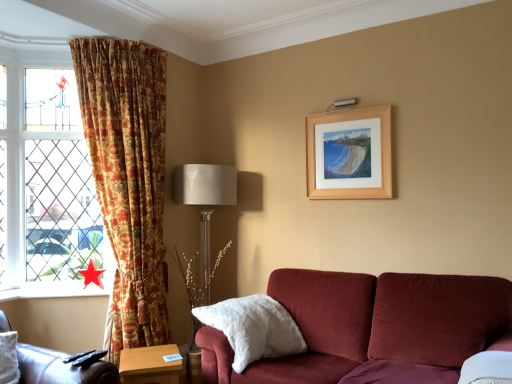
Question: Is leather at left taller than red paper star at lower left?

Choices:
 (A) no
 (B) yes

Answer: (B)

Question: Is leather at left facing away from red paper star at lower left?

Choices:
 (A) no
 (B) yes

Answer: (A)

Question: Can you confirm if leather at left is smaller than red paper star at lower left?

Choices:
 (A) yes
 (B) no

Answer: (B)

Question: From the image's perspective, is leather at left below red paper star at lower left?

Choices:
 (A) yes
 (B) no

Answer: (A)

Question: Does leather at left have a lesser height compared to red paper star at lower left?

Choices:
 (A) no
 (B) yes

Answer: (A)

Question: Is point (120, 382) positioned closer to the camera than point (31, 365)?

Choices:
 (A) closer
 (B) farther

Answer: (B)

Question: Which is correct: wooden table at lower center is inside leather at left, or outside of it?

Choices:
 (A) outside
 (B) inside

Answer: (A)

Question: Considering the relative positions of wooden table at lower center and leather at left in the image provided, is wooden table at lower center to the left or to the right of leather at left?

Choices:
 (A) left
 (B) right

Answer: (B)

Question: Considering their positions, is wooden table at lower center located in front of or behind leather at left?

Choices:
 (A) behind
 (B) front

Answer: (A)

Question: From their relative heights in the image, would you say wooden picture frame at upper right is taller or shorter than stained glass window at left?

Choices:
 (A) short
 (B) tall

Answer: (A)

Question: Looking at the image, does wooden picture frame at upper right seem bigger or smaller compared to stained glass window at left?

Choices:
 (A) big
 (B) small

Answer: (B)

Question: Which is correct: wooden picture frame at upper right is inside stained glass window at left, or outside of it?

Choices:
 (A) inside
 (B) outside

Answer: (B)

Question: Is wooden picture frame at upper right in front of or behind stained glass window at left in the image?

Choices:
 (A) front
 (B) behind

Answer: (A)

Question: Considering the positions of point (233, 337) and point (60, 62), is point (233, 337) closer or farther from the camera than point (60, 62)?

Choices:
 (A) closer
 (B) farther

Answer: (A)

Question: From their relative heights in the image, would you say white fluffy pillow at lower center is taller or shorter than stained glass window at left?

Choices:
 (A) tall
 (B) short

Answer: (B)